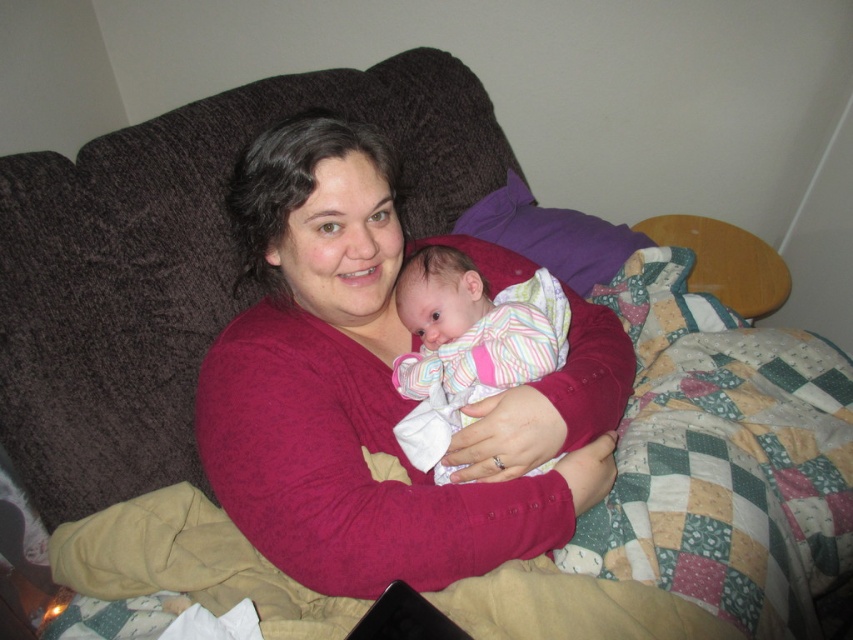
Question: Can you confirm if cotton sweater at center is smaller than striped cotton baby at center?

Choices:
 (A) yes
 (B) no

Answer: (B)

Question: Considering the relative positions of cotton sweater at center and striped cotton baby at center in the image provided, where is cotton sweater at center located with respect to striped cotton baby at center?

Choices:
 (A) above
 (B) below

Answer: (A)

Question: Is cotton sweater at center below striped cotton baby at center?

Choices:
 (A) no
 (B) yes

Answer: (A)

Question: Among these points, which one is nearest to the camera?

Choices:
 (A) (561, 499)
 (B) (534, 376)

Answer: (A)